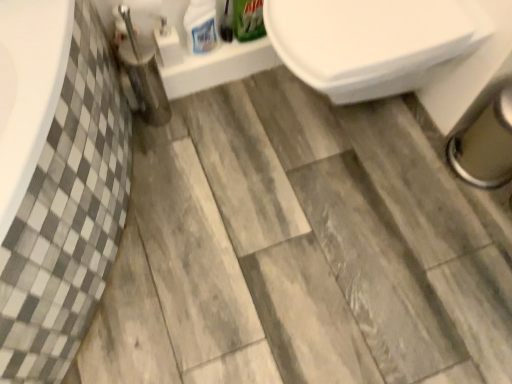
Locate an element on the screen. This screenshot has width=512, height=384. empty space that is in between white glossy toilet at upper right and brushed metal toilet brush at lower left is located at coordinates (226, 132).